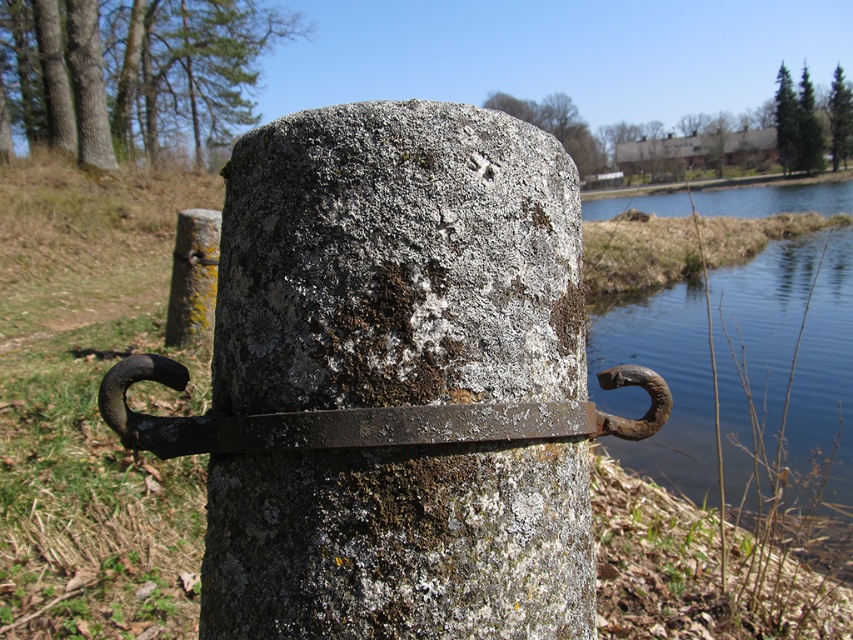
You are a painter standing 40 inches away from the stone post. You want to paint the rusty metal hook at center. Can you reach it without moving closer?

The rusty metal hook at center is 36.79 inches away from the camera. Since you are standing 40 inches away, you are 3.21 inches too far to reach it. You need to move closer by at least 3.21 inches to paint it.

You are standing at the edge of a lake and see the blue water at right and the green mossy stone at center. If you want to throw a small pebble to make a splash, which area would create a larger splash? Please explain your reasoning based on the scene description.

The blue water at right might create a larger splash because it is wider than the green mossy stone at center, suggesting it has a larger surface area for the pebble to hit.

You are standing in a garden and see the blue water at right and the green mossy stone at center. Which object is closer to you?

The blue water at right is closer to you because it is in front of the green mossy stone at center.